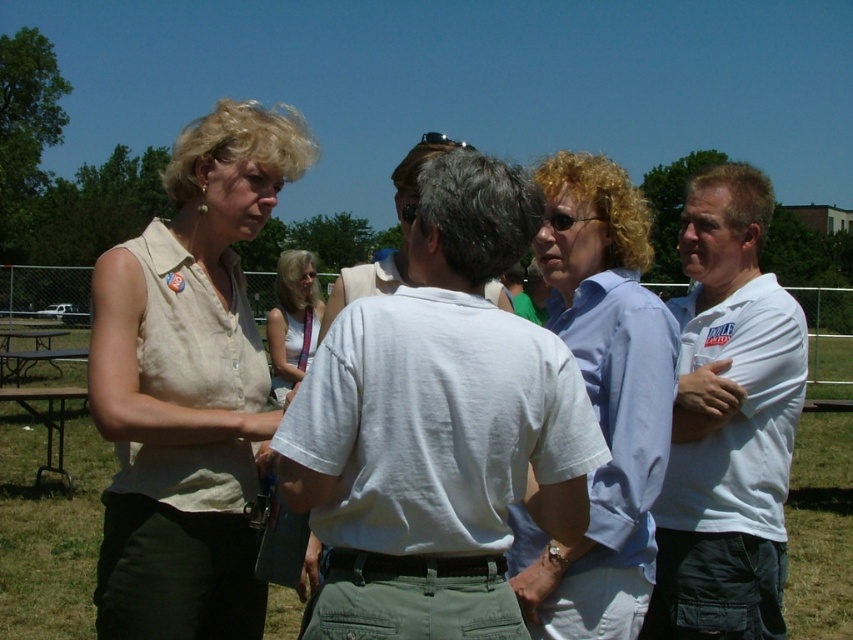
Is point (582, 216) more distant than point (317, 310)?

No, (582, 216) is in front of (317, 310).

Which is behind, point (625, 481) or point (296, 362)?

Positioned behind is point (296, 362).

Locate an element on the screen. The image size is (853, 640). light blue shirt at center is located at coordinates (601, 401).

Who is higher up, white cotton shirt at right or brown metal picnic table at lower left?

white cotton shirt at right is above.

Does white cotton shirt at right have a greater height compared to brown metal picnic table at lower left?

Yes.

Between point (686, 196) and point (22, 337), which one is positioned behind?

The point (686, 196) is behind.

Locate an element on the screen. Image resolution: width=853 pixels, height=640 pixels. white cotton shirt at right is located at coordinates (727, 422).

Which is above, white cotton shirt at center or white cotton shirt at right?

white cotton shirt at right

Who is more distant from viewer, (474,452) or (749,637)?

Point (749,637)

Does point (505, 408) lie in front of point (752, 467)?

Yes.

Image resolution: width=853 pixels, height=640 pixels. What are the coordinates of `white cotton shirt at center` in the screenshot? It's located at (438, 428).